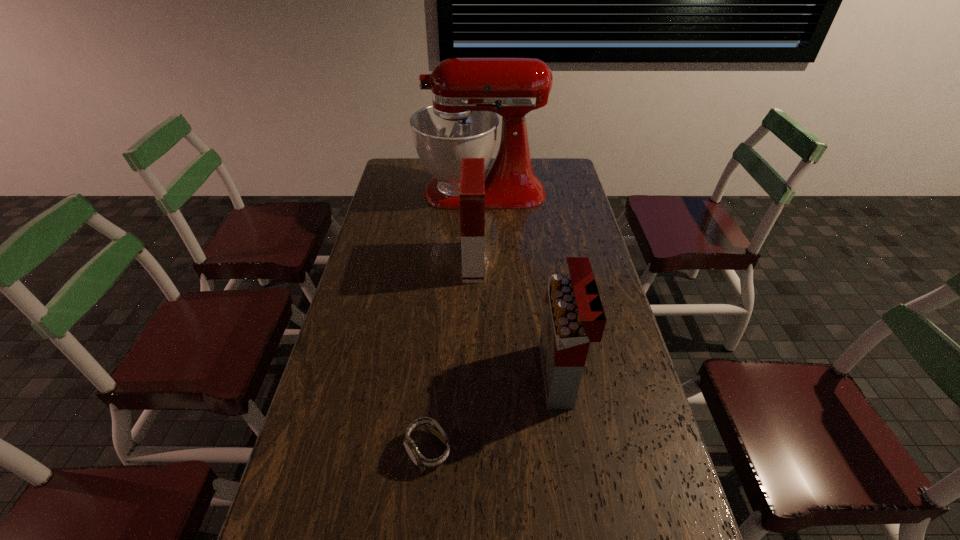
This screenshot has height=540, width=960. I want to click on free space located on the front-facing side of the left cigarette case, so click(540, 262).

In order to click on blank area located with the lid open on the nearer cigarette case in this screenshot , I will do `click(467, 375)`.

Where is `free space located 0.110m with the lid open on the nearer cigarette case`? free space located 0.110m with the lid open on the nearer cigarette case is located at coordinates (503, 375).

Identify the location of vacant area situated 0.230m with the lid open on the nearer cigarette case. The height and width of the screenshot is (540, 960). (460, 375).

This screenshot has width=960, height=540. Identify the location of blank area located on the face of the shortest object. (420, 538).

This screenshot has height=540, width=960. Find the location of `object that is at the far edge`. object that is at the far edge is located at coordinates click(467, 93).

Locate an element on the screen. This screenshot has width=960, height=540. object that is positioned at the left edge is located at coordinates (467, 93).

Identify the location of object located in the right edge section of the desktop. (467, 93).

What are the coordinates of `object that is at the far left corner` in the screenshot? It's located at (x=467, y=93).

Identify the location of object at the far right corner. This screenshot has height=540, width=960. (467, 93).